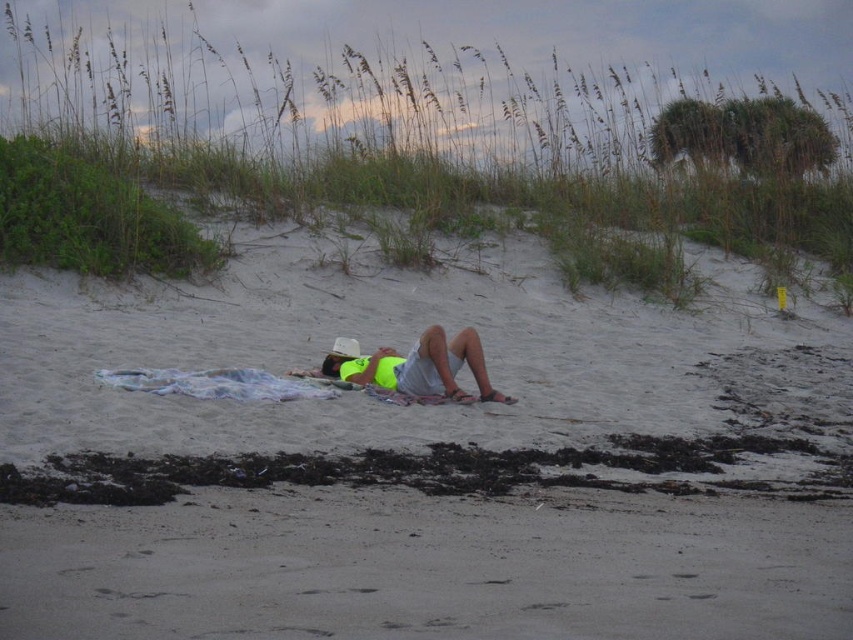
Question: Which of the following is the farthest from the observer?

Choices:
 (A) (248, 381)
 (B) (704, 534)
 (C) (374, 369)

Answer: (C)

Question: Which of the following is the farthest from the observer?

Choices:
 (A) white sand at center
 (B) white textured towel at center
 (C) neon yellow shirt at center

Answer: (C)

Question: Is white sand at center above white textured towel at center?

Choices:
 (A) yes
 (B) no

Answer: (A)

Question: Can you confirm if neon yellow shirt at center is positioned above white textured towel at center?

Choices:
 (A) yes
 (B) no

Answer: (A)

Question: Is white sand at center above neon yellow shirt at center?

Choices:
 (A) yes
 (B) no

Answer: (A)

Question: Estimate the real-world distances between objects in this image. Which object is closer to the white textured towel at center?

Choices:
 (A) white sand at center
 (B) neon yellow shirt at center

Answer: (B)